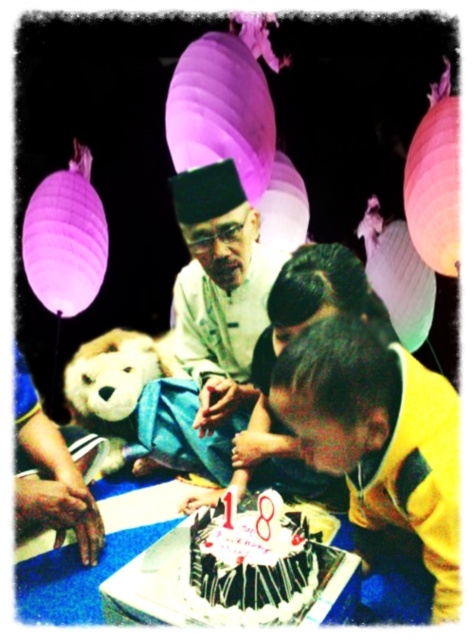
Question: Is white silk shirt at center to the left of fluffy white teddy bear at lower left from the viewer's perspective?

Choices:
 (A) no
 (B) yes

Answer: (A)

Question: Among these points, which one is nearest to the camera?

Choices:
 (A) (277, 515)
 (B) (121, 364)

Answer: (A)

Question: Which of the following is the farthest from the observer?

Choices:
 (A) (443, 474)
 (B) (116, 433)
 (C) (236, 323)
 (D) (303, 541)

Answer: (B)

Question: Which of the following is the farthest from the observer?

Choices:
 (A) (316, 444)
 (B) (176, 305)
 (C) (166, 360)

Answer: (C)

Question: Can you confirm if yellow fabric shirt at lower right is smaller than white paper cake at center?

Choices:
 (A) no
 (B) yes

Answer: (A)

Question: Is yellow fabric shirt at lower right to the right of white silk shirt at center from the viewer's perspective?

Choices:
 (A) no
 (B) yes

Answer: (B)